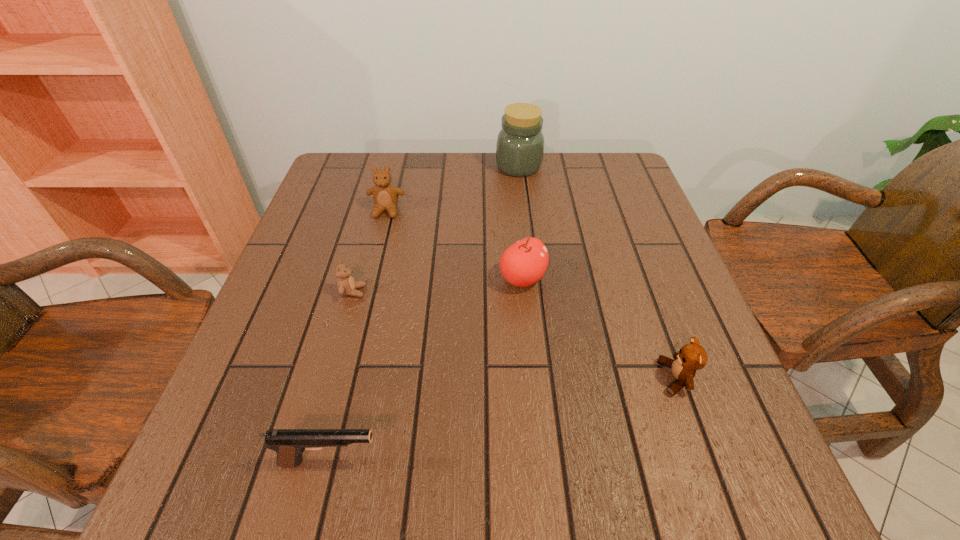
At what (x,y) coordinates should I click in order to perform the action: click on vacant region between the rightmost object and the farthest teddy bear. Please return your answer as a coordinate pair (x, y). This screenshot has width=960, height=540. Looking at the image, I should click on (532, 294).

In order to click on empty space between the second farthest teddy bear and the rightmost object in this screenshot , I will do `click(515, 335)`.

This screenshot has height=540, width=960. Find the location of `vacant point located between the rightmost teddy bear and the pistol`. vacant point located between the rightmost teddy bear and the pistol is located at coordinates click(x=503, y=420).

Locate an element on the screen. The width and height of the screenshot is (960, 540). vacant region between the jar and the fifth nearest object is located at coordinates (452, 188).

This screenshot has width=960, height=540. I want to click on empty location between the tallest teddy bear and the tallest object, so click(x=452, y=188).

In order to click on vacant space that's between the tallest teddy bear and the nearest object in this screenshot , I will do `click(358, 336)`.

Locate which object ranks second in proximity to the second farthest object. Please provide its 2D coordinates. Your answer should be formatted as a tuple, i.e. [(x, y)], where the tuple contains the x and y coordinates of a point satisfying the conditions above.

[(520, 143)]

Find the location of a particular element. The height and width of the screenshot is (540, 960). the fifth closest object relative to the rightmost object is located at coordinates (385, 195).

You are a GUI agent. You are given a task and a screenshot of the screen. Output one action in this format:
    pyautogui.click(x=<x>, y=<y>)
    Task: Click on the teddy bear that is the second closest to the farthest teddy bear
    Image resolution: width=960 pixels, height=540 pixels.
    Given the screenshot: What is the action you would take?
    pyautogui.click(x=691, y=357)

Identify which teddy bear is the second nearest to the second farthest object. Please provide its 2D coordinates. Your answer should be formatted as a tuple, i.e. [(x, y)], where the tuple contains the x and y coordinates of a point satisfying the conditions above.

[(691, 357)]